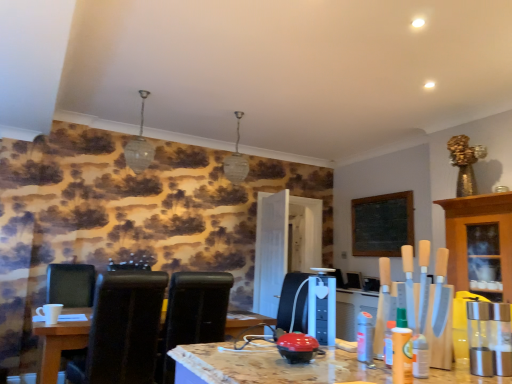
Question: Could black leather chair at left, placed as the 2th chair when sorted from right to left, be considered to be inside black leather chair at center, placed as the 3th chair when sorted from left to right?

Choices:
 (A) no
 (B) yes

Answer: (A)

Question: Is black leather chair at center, placed as the 3th chair when sorted from left to right, outside of black leather chair at left, placed as the 2th chair when sorted from right to left?

Choices:
 (A) no
 (B) yes

Answer: (B)

Question: Can you confirm if black leather chair at center, placed as the 3th chair when sorted from left to right, is wider than black leather chair at left, arranged as the 2th chair when viewed from the left?

Choices:
 (A) yes
 (B) no

Answer: (B)

Question: From the image's perspective, is black leather chair at center, placed as the 3th chair when sorted from left to right, on top of black leather chair at left, placed as the 2th chair when sorted from right to left?

Choices:
 (A) yes
 (B) no

Answer: (B)

Question: Is black leather chair at center, placed as the 1th chair when sorted from right to left, smaller than black leather chair at left, placed as the 2th chair when sorted from right to left?

Choices:
 (A) yes
 (B) no

Answer: (B)

Question: Is black leather chair at center, placed as the 1th chair when sorted from right to left, facing away from black leather chair at left, placed as the 2th chair when sorted from right to left?

Choices:
 (A) no
 (B) yes

Answer: (A)

Question: Is wooden table at lower left thinner than black leather chair at lower left, the third chair from the right?

Choices:
 (A) yes
 (B) no

Answer: (B)

Question: Does wooden table at lower left come in front of black leather chair at lower left, the 1th chair from the left?

Choices:
 (A) no
 (B) yes

Answer: (B)

Question: From the image's perspective, is wooden table at lower left located above black leather chair at lower left, the third chair from the right?

Choices:
 (A) no
 (B) yes

Answer: (A)

Question: From a real-world perspective, is wooden table at lower left located beneath black leather chair at lower left, the 1th chair from the left?

Choices:
 (A) yes
 (B) no

Answer: (A)

Question: From a real-world perspective, is wooden table at lower left on top of black leather chair at lower left, the third chair from the right?

Choices:
 (A) no
 (B) yes

Answer: (A)

Question: Is wooden table at lower left oriented away from black leather chair at lower left, the third chair from the right?

Choices:
 (A) no
 (B) yes

Answer: (B)

Question: From the image's perspective, is black leather chair at lower left, the third chair from the right, located above black leather chair at left, placed as the 2th chair when sorted from right to left?

Choices:
 (A) yes
 (B) no

Answer: (B)